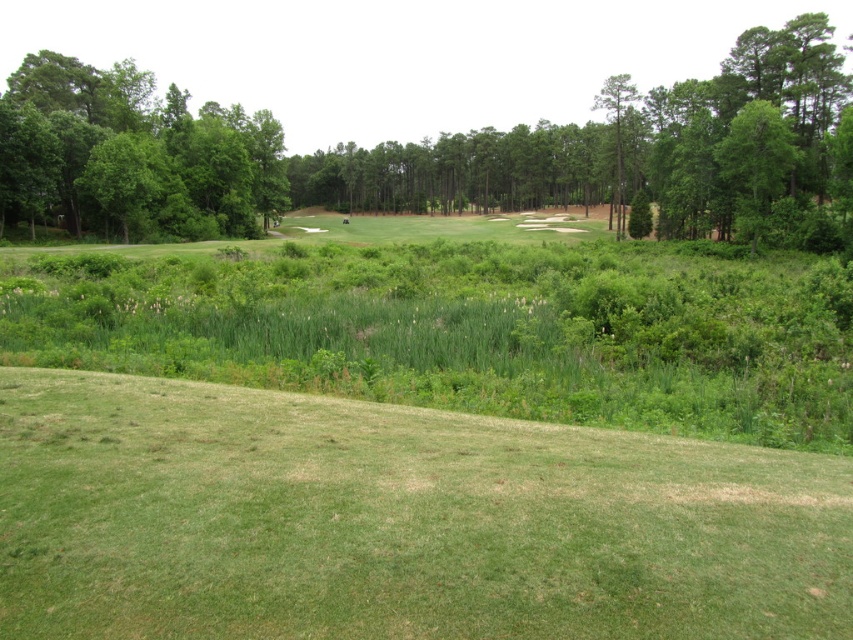
Who is lower down, green grassy hill at lower center or green leafy tree at center?

green grassy hill at lower center

Which of these two, green grassy hill at lower center or green leafy tree at center, stands taller?

green leafy tree at center is taller.

Find the location of a particular element. green grassy hill at lower center is located at coordinates (395, 522).

This screenshot has height=640, width=853. I want to click on green grassy hill at lower center, so click(x=395, y=522).

Is point (759, 477) farther from viewer compared to point (172, 211)?

No.

Is green grassy hill at lower center positioned behind green leafy tree at left?

No, green grassy hill at lower center is closer to the viewer.

Is point (334, 586) more distant than point (134, 120)?

No, (334, 586) is closer to viewer.

You are a GUI agent. You are given a task and a screenshot of the screen. Output one action in this format:
    pyautogui.click(x=<x>, y=<y>)
    Task: Click on the green grassy hill at lower center
    This screenshot has height=640, width=853.
    Given the screenshot: What is the action you would take?
    pyautogui.click(x=395, y=522)

Based on the photo, can you confirm if green leafy tree at center is shorter than green leafy tree at left?

In fact, green leafy tree at center may be taller than green leafy tree at left.

Does green leafy tree at center have a greater height compared to green leafy tree at left?

Correct, green leafy tree at center is much taller as green leafy tree at left.

Image resolution: width=853 pixels, height=640 pixels. What are the coordinates of `green leafy tree at center` in the screenshot? It's located at (643, 150).

Image resolution: width=853 pixels, height=640 pixels. In order to click on green leafy tree at center in this screenshot , I will do `click(643, 150)`.